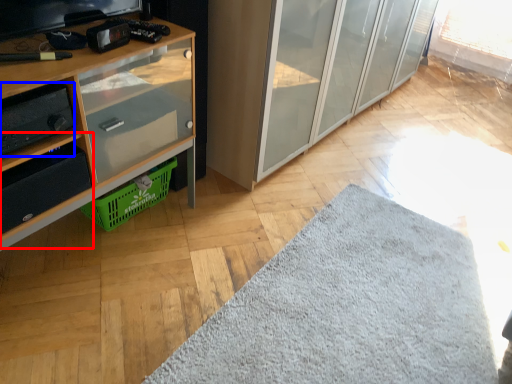
Question: Which point is closer to the camera, shelf (highlighted by a red box) or stereo (highlighted by a blue box)?

Choices:
 (A) shelf
 (B) stereo

Answer: (B)